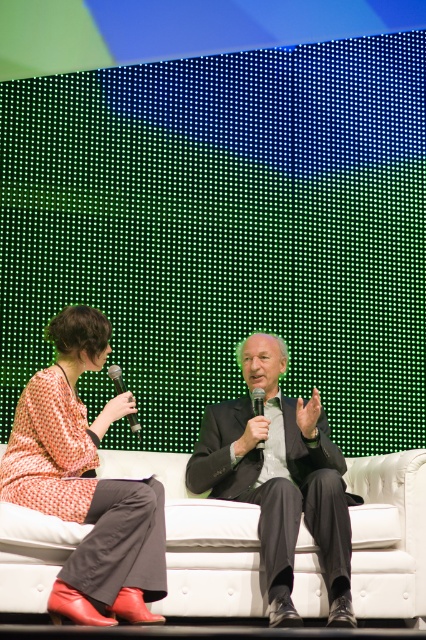
Which is more to the left, matte black suit at center or black matte microphone at center?

black matte microphone at center

Image resolution: width=426 pixels, height=640 pixels. Identify the location of matte black suit at center. (279, 477).

Does matte orange dress at center appear on the left side of matte black suit at center?

Yes, matte orange dress at center is to the left of matte black suit at center.

Between matte orange dress at center and matte black suit at center, which one has less height?

matte black suit at center

Between point (88, 452) and point (273, 432), which one is positioned behind?

Point (273, 432)

Where is `matte orange dress at center`? This screenshot has height=640, width=426. matte orange dress at center is located at coordinates (86, 483).

The image size is (426, 640). I want to click on white fabric couch at center, so click(198, 541).

Identify the location of white fabric couch at center. (198, 541).

The width and height of the screenshot is (426, 640). In order to click on white fabric couch at center in this screenshot , I will do [x=198, y=541].